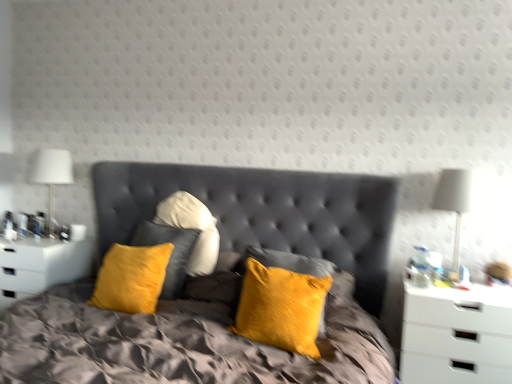
Question: From a real-world perspective, is velvet yellow pillow at center under white matte nightstand at right, which is counted as the 2th nightstand, starting from the left?

Choices:
 (A) no
 (B) yes

Answer: (A)

Question: Is velvet yellow pillow at center not inside white matte nightstand at right, the second nightstand when ordered from back to front?

Choices:
 (A) no
 (B) yes

Answer: (B)

Question: Is velvet yellow pillow at center next to white matte nightstand at right, acting as the 1th nightstand starting from the front?

Choices:
 (A) no
 (B) yes

Answer: (A)

Question: From the image's perspective, is velvet yellow pillow at center located beneath white matte nightstand at right, placed as the 1th nightstand when sorted from right to left?

Choices:
 (A) yes
 (B) no

Answer: (B)

Question: From the image's perspective, is velvet yellow pillow at center located above white matte nightstand at right, the second nightstand when ordered from back to front?

Choices:
 (A) no
 (B) yes

Answer: (B)

Question: From the image's perspective, is white fabric lampshade at right, positioned as the first bedside lamp in right-to-left order, positioned above or below velvet yellow pillows at center?

Choices:
 (A) above
 (B) below

Answer: (A)

Question: Is point (437, 195) positioned closer to the camera than point (381, 374)?

Choices:
 (A) closer
 (B) farther

Answer: (B)

Question: In terms of height, does white fabric lampshade at right, placed as the second bedside lamp when sorted from back to front, look taller or shorter compared to velvet yellow pillows at center?

Choices:
 (A) tall
 (B) short

Answer: (B)

Question: From a real-world perspective, is white fabric lampshade at right, placed as the second bedside lamp when sorted from back to front, physically located above or below velvet yellow pillows at center?

Choices:
 (A) above
 (B) below

Answer: (A)

Question: In terms of height, does velvet yellow pillows at center look taller or shorter compared to white fabric lampshade at right, which is the 2th bedside lamp from left to right?

Choices:
 (A) short
 (B) tall

Answer: (B)

Question: Is velvet yellow pillows at center to the left or to the right of white fabric lampshade at right, positioned as the first bedside lamp in front-to-back order, in the image?

Choices:
 (A) right
 (B) left

Answer: (B)

Question: From a real-world perspective, is velvet yellow pillows at center above or below white fabric lampshade at right, which is the 2th bedside lamp from left to right?

Choices:
 (A) above
 (B) below

Answer: (B)

Question: Considering the positions of point (290, 218) and point (458, 190), is point (290, 218) closer or farther from the camera than point (458, 190)?

Choices:
 (A) closer
 (B) farther

Answer: (B)

Question: Relative to white fabric lampshade at left, the second bedside lamp viewed from the front, is velvet yellow pillow at center in front or behind?

Choices:
 (A) front
 (B) behind

Answer: (A)

Question: Is velvet yellow pillow at center inside the boundaries of white fabric lampshade at left, positioned as the second bedside lamp in right-to-left order, or outside?

Choices:
 (A) outside
 (B) inside

Answer: (A)